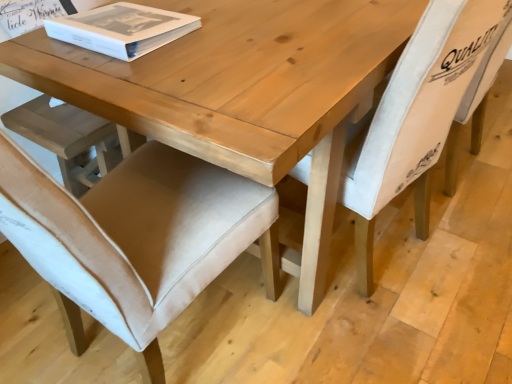
Where is `free space in front of light beige fabric chair at center, which is the second chair from left to right`? free space in front of light beige fabric chair at center, which is the second chair from left to right is located at coordinates (385, 330).